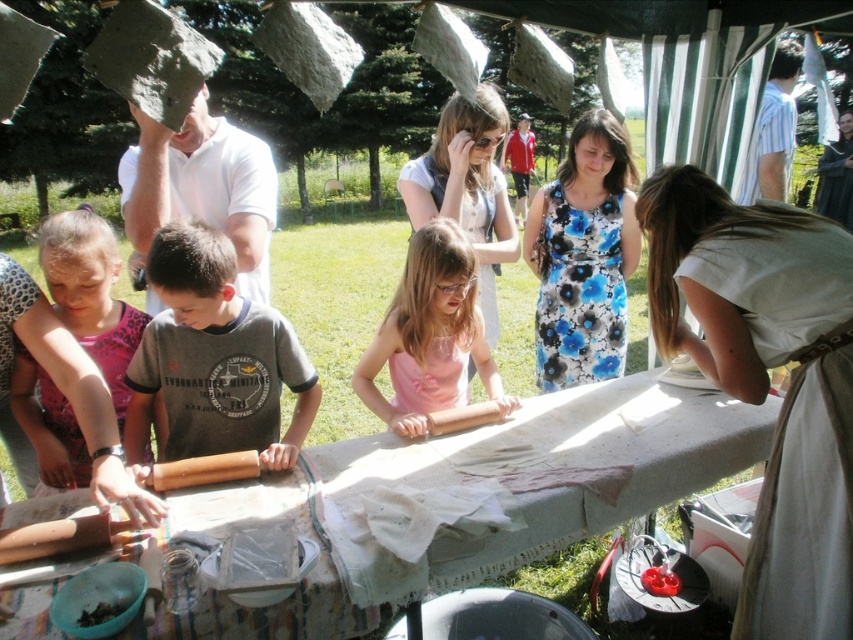
Is white cloth-covered table at center to the left of pink fabric at center from the viewer's perspective?

Incorrect, white cloth-covered table at center is not on the left side of pink fabric at center.

Who is shorter, white cloth-covered table at center or pink fabric at center?

white cloth-covered table at center

Consider the image. Measure the distance between white cloth-covered table at center and camera.

A distance of 1.22 meters exists between white cloth-covered table at center and camera.

At what (x,y) coordinates should I click in order to perform the action: click on white cloth-covered table at center. Please return your answer as a coordinate pair (x, y). The width and height of the screenshot is (853, 640). Looking at the image, I should click on (515, 496).

Between point (178, 268) and point (18, 372), which one is positioned behind?

Positioned behind is point (18, 372).

Is point (256, 394) positioned in front of point (41, 246)?

No, it is not.

This screenshot has height=640, width=853. Find the location of `brown wooden rolling pin at center`. brown wooden rolling pin at center is located at coordinates (213, 358).

At what (x,y) coordinates should I click in order to perform the action: click on brown wooden rolling pin at center. Please return your answer as a coordinate pair (x, y). Looking at the image, I should click on (213, 358).

Is point (410, 362) farther from viewer compared to point (119, 604)?

That is True.

Does point (469, 348) come behind point (78, 620)?

Yes, point (469, 348) is behind point (78, 620).

Find the location of a particular element. pink fabric at center is located at coordinates (430, 336).